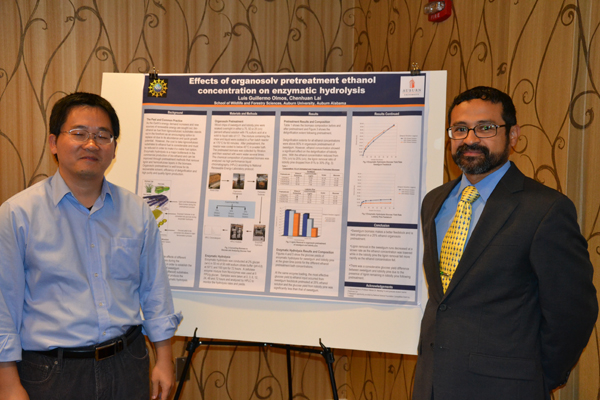
You are a GUI agent. You are given a task and a screenshot of the screen. Output one action in this format:
    pyautogui.click(x=<x>, y=<y>)
    Task: Click on the stand
    Image resolution: width=600 pixels, height=400 pixels.
    Given the screenshot: What is the action you would take?
    pyautogui.click(x=262, y=346)